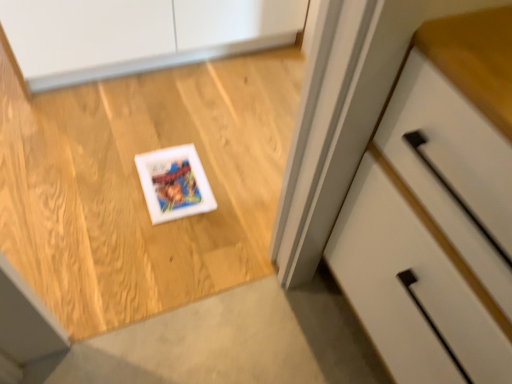
Locate an element on the screen. The width and height of the screenshot is (512, 384). empty space that is ontop of white glossy comic book at center is located at coordinates (174, 179).